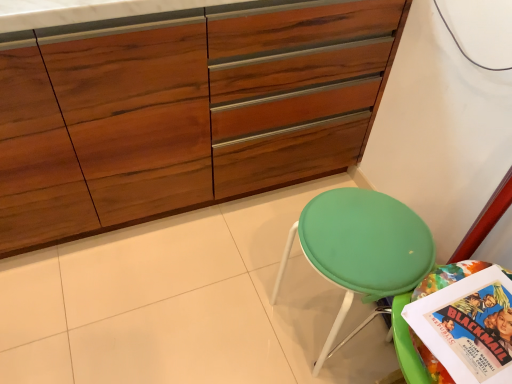
In order to face wooden cabinet at center, should I rotate leftwards or rightwards?

You should rotate left by 11.508 degrees.

Locate an element on the screen. multicolored paper comic book at lower right is located at coordinates (478, 328).

Where is `green fabric stool at lower right`? Image resolution: width=512 pixels, height=384 pixels. green fabric stool at lower right is located at coordinates (361, 247).

From a real-world perspective, relative to wooden cabinet at center, is multicolored paper comic book at lower right vertically above or below?

In terms of real-world spatial position, multicolored paper comic book at lower right is above wooden cabinet at center.

Identify the location of comic book in front of the wooden cabinet at center. (478, 328).

Which object is positioned more to the left, multicolored paper comic book at lower right or wooden cabinet at center?

wooden cabinet at center is more to the left.

Is multicolored paper comic book at lower right smaller than green fabric stool at lower right?

Yes, multicolored paper comic book at lower right is smaller than green fabric stool at lower right.

Locate an element on the screen. Image resolution: width=512 pixels, height=384 pixels. comic book located above the green fabric stool at lower right (from a real-world perspective) is located at coordinates (478, 328).

From a real-world perspective, is multicolored paper comic book at lower right beneath green fabric stool at lower right?

No, from a real-world perspective, multicolored paper comic book at lower right is not under green fabric stool at lower right.

Does multicolored paper comic book at lower right have a lesser width compared to green fabric stool at lower right?

Yes.

Does wooden cabinet at center have a larger size compared to multicolored paper comic book at lower right?

Yes.

Is wooden cabinet at center to the left of multicolored paper comic book at lower right from the viewer's perspective?

Correct, you'll find wooden cabinet at center to the left of multicolored paper comic book at lower right.

Is wooden cabinet at center facing towards multicolored paper comic book at lower right?

Yes, wooden cabinet at center is facing multicolored paper comic book at lower right.

How far apart are wooden cabinet at center and green fabric stool at lower right?

The distance of wooden cabinet at center from green fabric stool at lower right is 54.72 centimeters.

Is wooden cabinet at center wider than green fabric stool at lower right?

Yes, wooden cabinet at center is wider than green fabric stool at lower right.

From the image's perspective, is wooden cabinet at center under green fabric stool at lower right?

Incorrect, from the image's perspective, wooden cabinet at center is higher than green fabric stool at lower right.

Considering the relative positions of wooden cabinet at center and green fabric stool at lower right in the image provided, is wooden cabinet at center to the right of green fabric stool at lower right from the viewer's perspective?

Incorrect, wooden cabinet at center is not on the right side of green fabric stool at lower right.

Is green fabric stool at lower right not within multicolored paper comic book at lower right?

Yes.

Does green fabric stool at lower right come in front of multicolored paper comic book at lower right?

No, green fabric stool at lower right is further to the viewer.

Is green fabric stool at lower right to the right of multicolored paper comic book at lower right from the viewer's perspective?

No.

From the image's perspective, is green fabric stool at lower right located above or below multicolored paper comic book at lower right?

Clearly, from the image's perspective, green fabric stool at lower right is above multicolored paper comic book at lower right.

Is point (366, 227) behind point (82, 41)?

Yes, it is behind point (82, 41).

Is green fabric stool at lower right spatially inside wooden cabinet at center, or outside of it?

green fabric stool at lower right lies outside wooden cabinet at center.

This screenshot has width=512, height=384. Find the location of `cabinetry on the left side of green fabric stool at lower right`. cabinetry on the left side of green fabric stool at lower right is located at coordinates (182, 110).

Is green fabric stool at lower right oriented towards wooden cabinet at center?

No.

This screenshot has height=384, width=512. I want to click on comic book located below the wooden cabinet at center (from the image's perspective), so click(x=478, y=328).

Identify the location of chair above the multicolored paper comic book at lower right (from the image's perspective). (361, 247).

From the image, which object appears to be farther from green fabric stool at lower right, wooden cabinet at center or multicolored paper comic book at lower right?

wooden cabinet at center is positioned further to the anchor green fabric stool at lower right.

Considering their positions, is wooden cabinet at center positioned closer to multicolored paper comic book at lower right than green fabric stool at lower right?

Among the two, green fabric stool at lower right is located nearer to multicolored paper comic book at lower right.

From the image, which object appears to be farther from green fabric stool at lower right, multicolored paper comic book at lower right or wooden cabinet at center?

wooden cabinet at center is positioned further to the anchor green fabric stool at lower right.

Based on their spatial positions, is green fabric stool at lower right or multicolored paper comic book at lower right further from wooden cabinet at center?

multicolored paper comic book at lower right is further to wooden cabinet at center.

Looking at the image, which one is located further to wooden cabinet at center, multicolored paper comic book at lower right or green fabric stool at lower right?

multicolored paper comic book at lower right is further to wooden cabinet at center.

Considering their positions, is green fabric stool at lower right positioned closer to multicolored paper comic book at lower right than wooden cabinet at center?

The object closer to multicolored paper comic book at lower right is green fabric stool at lower right.

In order to click on chair between wooden cabinet at center and multicolored paper comic book at lower right in the horizontal direction in this screenshot , I will do `click(361, 247)`.